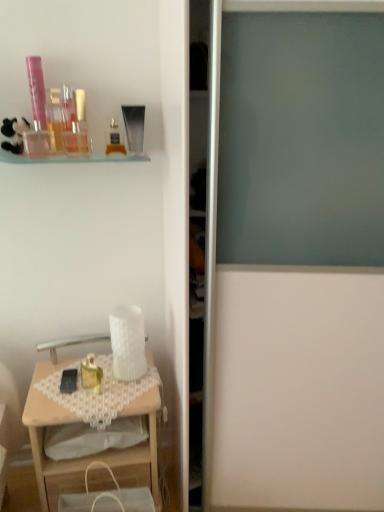
Find the location of `vacant area that lies to the right of black matte mobile phone at lower left`. vacant area that lies to the right of black matte mobile phone at lower left is located at coordinates (114, 381).